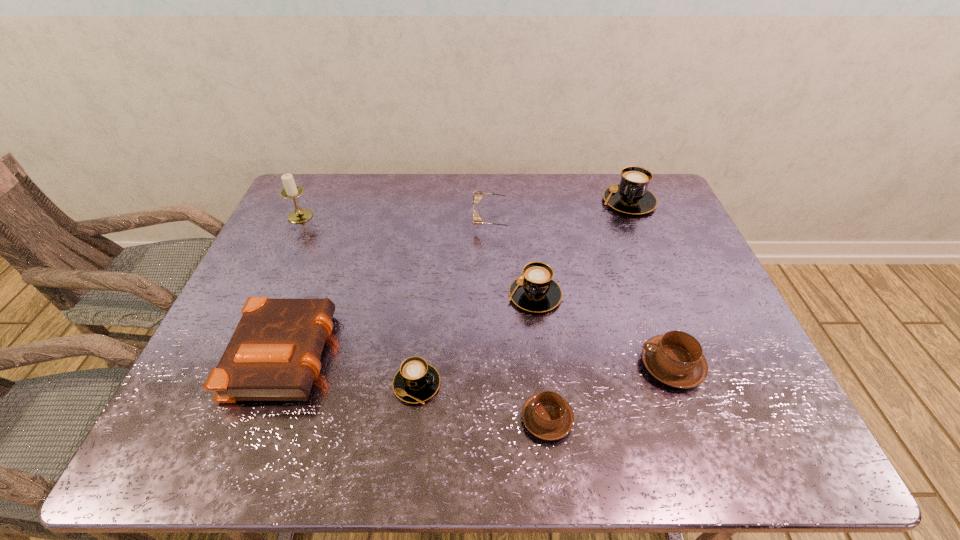
The width and height of the screenshot is (960, 540). I want to click on sunglasses present at the far edge, so click(x=477, y=220).

Locate an element on the screen. object present at the near edge is located at coordinates (547, 415).

Locate an element on the screen. The width and height of the screenshot is (960, 540). candle holder located at the left edge is located at coordinates (291, 190).

Where is `Bible that is at the left edge`? The width and height of the screenshot is (960, 540). Bible that is at the left edge is located at coordinates (274, 354).

Locate an element on the screen. Image resolution: width=960 pixels, height=540 pixels. object present at the far left corner is located at coordinates (291, 190).

Where is `object present at the far right corner`? object present at the far right corner is located at coordinates [x=631, y=196].

In the image, there is a desktop. At what (x,y) coordinates should I click in order to perform the action: click on free region at the far edge. Please return your answer as a coordinate pair (x, y). This screenshot has height=540, width=960. Looking at the image, I should click on (492, 203).

Where is `vacant space at the near edge of the desktop`? The width and height of the screenshot is (960, 540). vacant space at the near edge of the desktop is located at coordinates (611, 420).

I want to click on vacant space at the left edge of the desktop, so click(195, 416).

Locate an element on the screen. Image resolution: width=960 pixels, height=540 pixels. free spot at the right edge of the desktop is located at coordinates (721, 306).